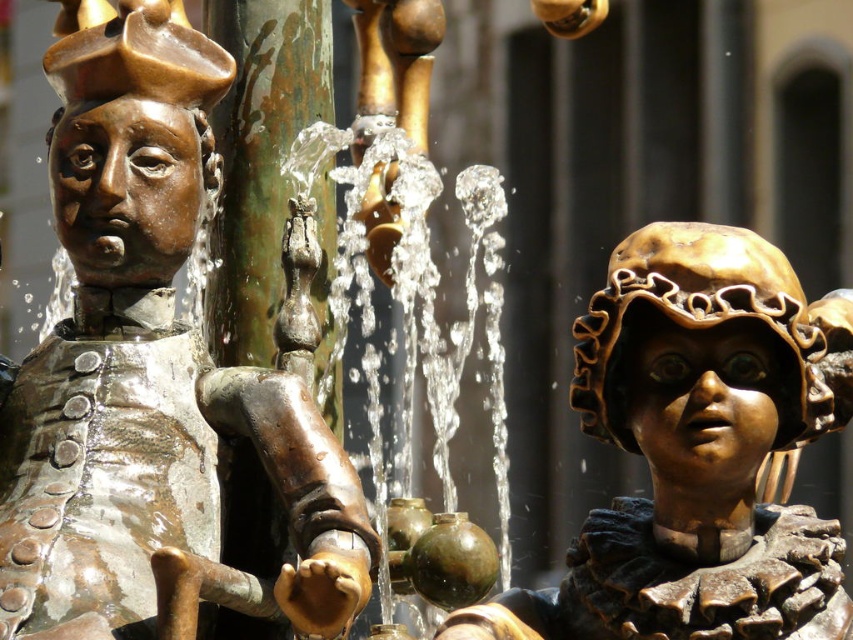
Question: Among these objects, which one is farthest from the camera?

Choices:
 (A) gold-bronze mask at right
 (B) bronze statue at center

Answer: (A)

Question: Does bronze statue at center have a greater width compared to gold-bronze mask at right?

Choices:
 (A) yes
 (B) no

Answer: (A)

Question: Is bronze statue at center to the left of gold-bronze mask at right from the viewer's perspective?

Choices:
 (A) yes
 (B) no

Answer: (A)

Question: In this image, where is bronze statue at center located relative to gold-bronze mask at right?

Choices:
 (A) right
 (B) left

Answer: (B)

Question: Which of the following is the farthest from the observer?

Choices:
 (A) click(59, 568)
 (B) click(756, 369)

Answer: (B)